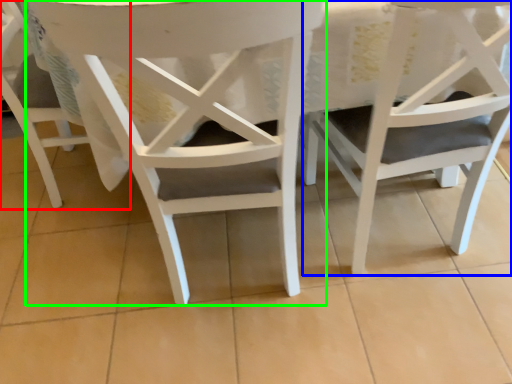
Question: Which is nearer to the chair (highlighted by a red box)? chair (highlighted by a blue box) or chair (highlighted by a green box).

Choices:
 (A) chair
 (B) chair

Answer: (B)